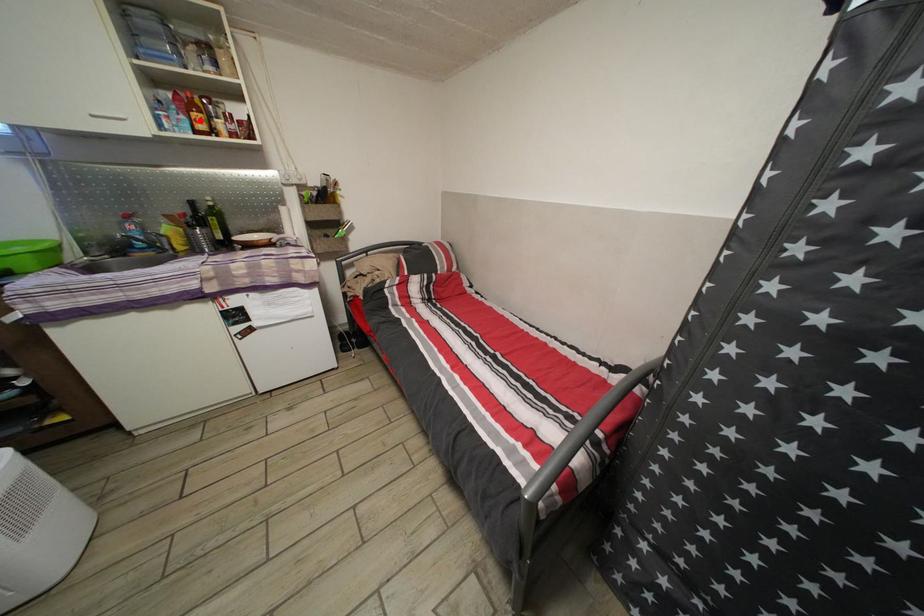
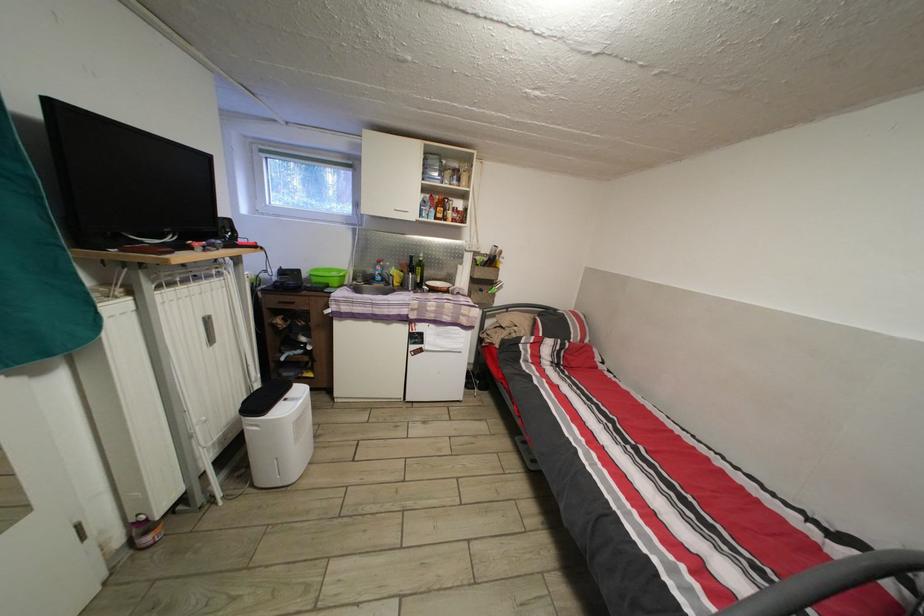
Question: I am providing you with two images of the same scene from different viewpoints. Image1 has a red point marked. In image2, the corresponding 3D location appears at what relative position? Reply with the corresponding letter.

Choices:
 (A) Closer
 (B) Farther

Answer: (A)